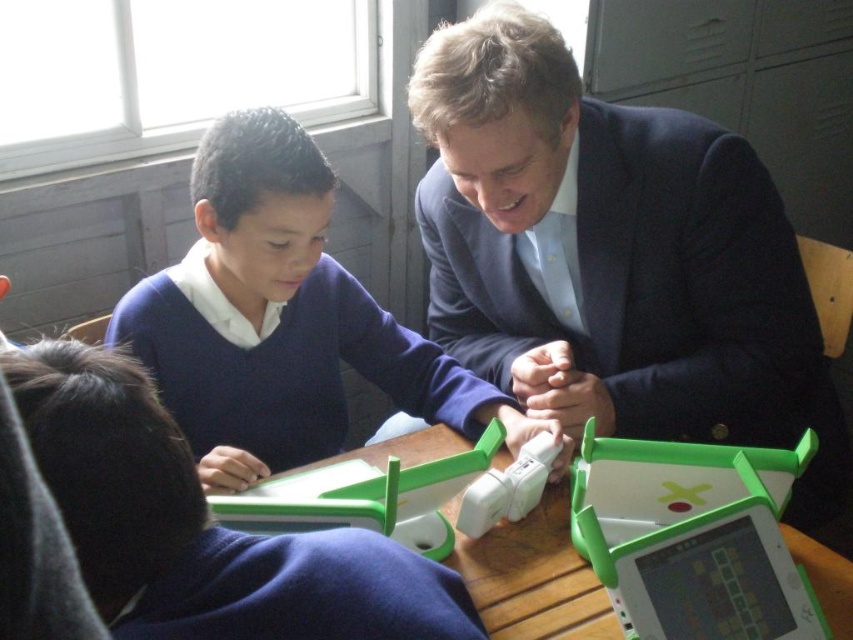
In the scene shown: You are a student sitting at the table in the classroom. You need to reach both the point at coordinates [143,337] and the point at [602,628]. Which point should you reach for first if you want to touch them in order from closest to farthest?

You should reach for point [602,628] first because it is closer to you than point [143,337], which is behind it.

You are a photographer standing in front of the classroom scene. You want to take a photo that includes both the dark blue sweater at upper center and the matte green plastic tablet at lower left. Which object should you focus on first to ensure both are in clear focus?

You should focus on the dark blue sweater at upper center first because it is closer to you than the matte green plastic tablet at lower left. Since it is closer, focusing on it will help ensure both objects are in focus when using a shallow depth of field.

You are a teacher who needs to place a 9 inch ruler between the dark blue sweater at upper center and the wooden table at center. Can the ruler fit between them?

The distance between the dark blue sweater at upper center and the wooden table at center is 8.84 inches, so the 9 inch ruler cannot fit between them as it is slightly longer than the available space.